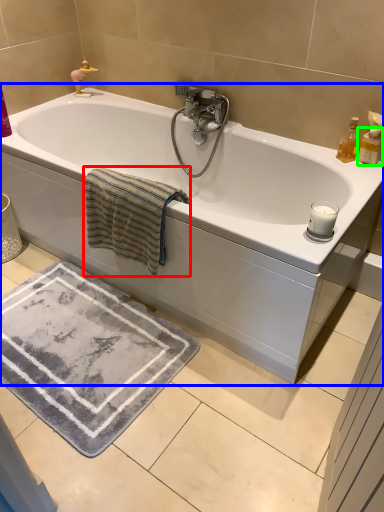
Question: Estimate the real-world distances between objects in this image. Which object is farther from bath towel (highlighted by a red box), bathtub (highlighted by a blue box) or toiletry (highlighted by a green box)?

Choices:
 (A) bathtub
 (B) toiletry

Answer: (B)